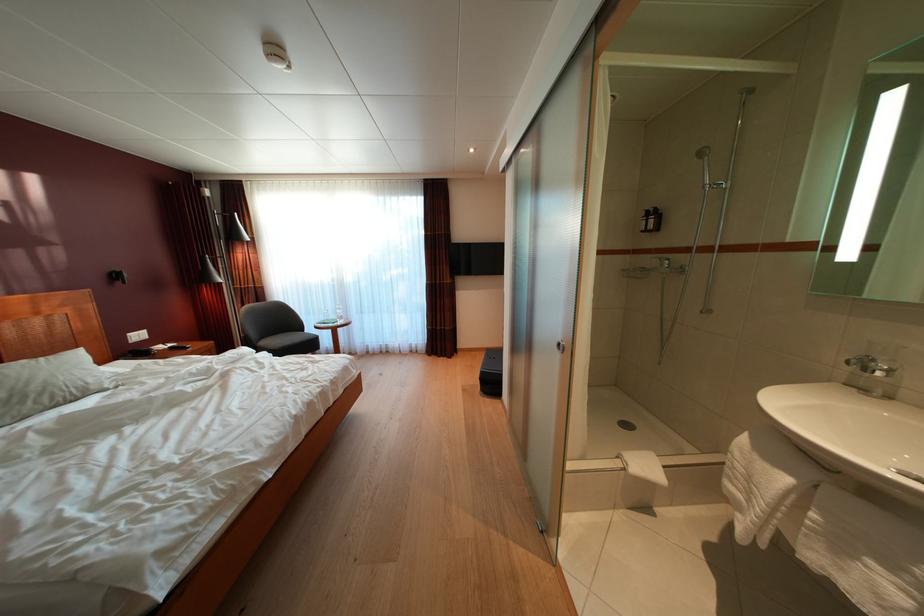
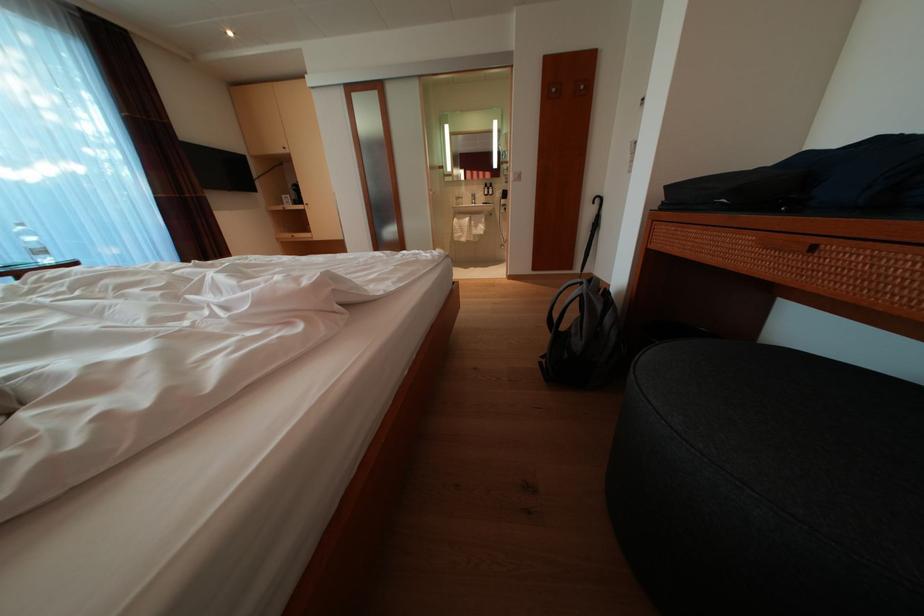
Where in the second image is the point corresponding to the point at 794,485 from the first image?

(476, 225)